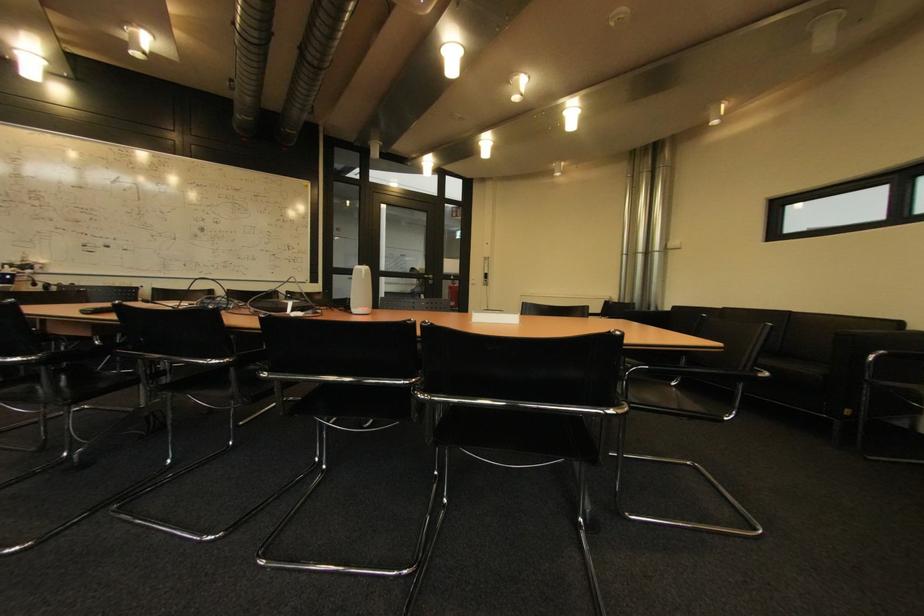
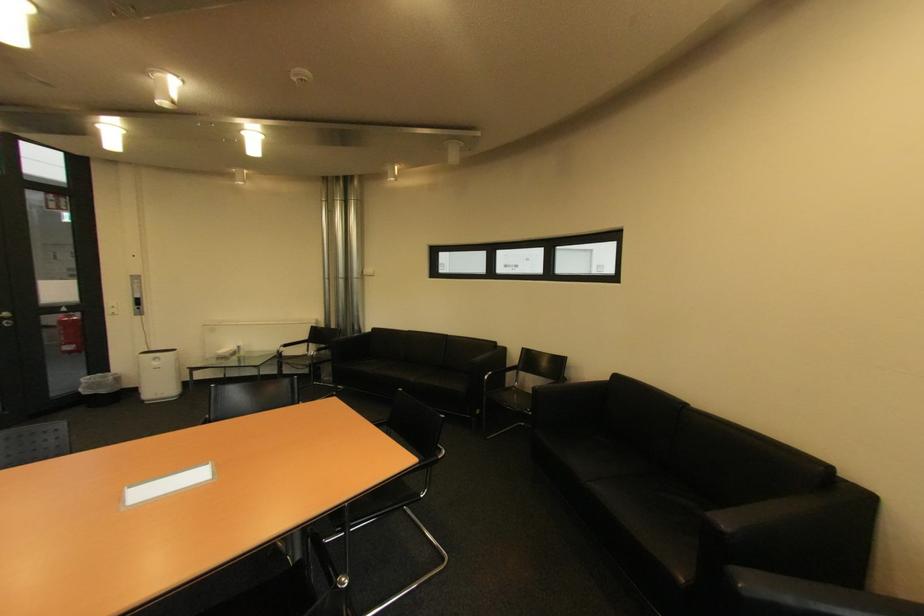
Locate, in the second image, the point that corresponds to pixel 459 305 in the first image.

(79, 349)